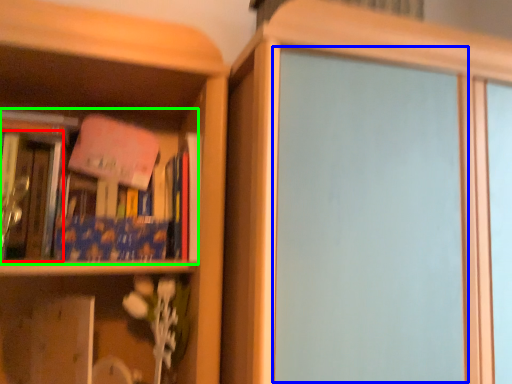
Question: Which is farther away from book (highlighted by a red box)? screen door (highlighted by a blue box) or book (highlighted by a green box)?

Choices:
 (A) screen door
 (B) book

Answer: (A)